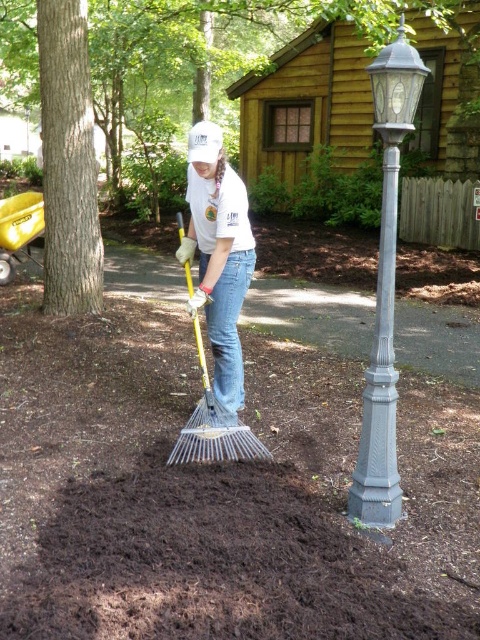
Question: Which object is the closest to the white matte t-shirt at center?

Choices:
 (A) gray cast iron pole at right
 (B) yellow plastic rake at center
 (C) gray cast iron lamp post at right

Answer: (B)

Question: Is gray cast iron lamp post at right smaller than yellow plastic rake at center?

Choices:
 (A) yes
 (B) no

Answer: (B)

Question: Which is farther from the gray cast iron pole at right?

Choices:
 (A) gray cast iron lamp post at right
 (B) white matte t-shirt at center
 (C) yellow plastic rake at center

Answer: (B)

Question: Which of the following is the farthest from the observer?

Choices:
 (A) gray cast iron lamp post at right
 (B) white matte t-shirt at center
 (C) yellow plastic rake at center
 (D) gray cast iron pole at right

Answer: (C)

Question: Can you confirm if gray cast iron lamp post at right is smaller than white matte t-shirt at center?

Choices:
 (A) yes
 (B) no

Answer: (A)

Question: Observing the image, what is the correct spatial positioning of gray cast iron lamp post at right in reference to yellow plastic rake at center?

Choices:
 (A) below
 (B) above

Answer: (B)